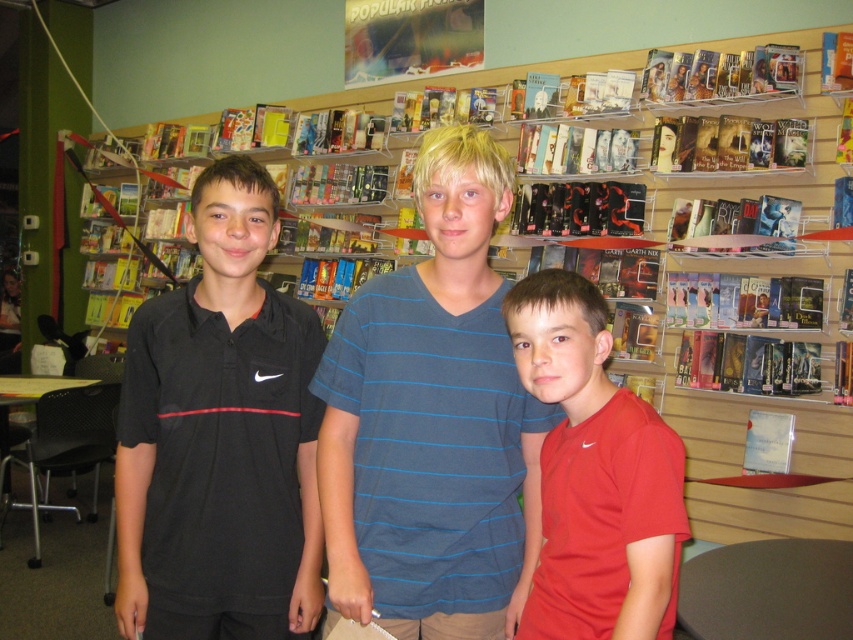
Measure the distance between blue striped shirt at center and black nike polo shirt at left.

blue striped shirt at center and black nike polo shirt at left are 25.12 centimeters apart from each other.

Does blue striped shirt at center appear over black nike polo shirt at left?

Indeed, blue striped shirt at center is positioned over black nike polo shirt at left.

At what (x,y) coordinates should I click in order to perform the action: click on blue striped shirt at center. Please return your answer as a coordinate pair (x, y). Looking at the image, I should click on (433, 420).

Which is below, black nike polo shirt at left or red matte shirt at center?

red matte shirt at center

Locate an element on the screen. This screenshot has width=853, height=640. black nike polo shirt at left is located at coordinates [219, 436].

This screenshot has width=853, height=640. I want to click on black nike polo shirt at left, so click(x=219, y=436).

Locate an element on the screen. black nike polo shirt at left is located at coordinates (219, 436).

Is blue striped shirt at center behind red matte shirt at center?

Yes, it is behind red matte shirt at center.

Which is behind, point (496, 372) or point (643, 630)?

The point (496, 372) is behind.

Identify the location of blue striped shirt at center. Image resolution: width=853 pixels, height=640 pixels. (433, 420).